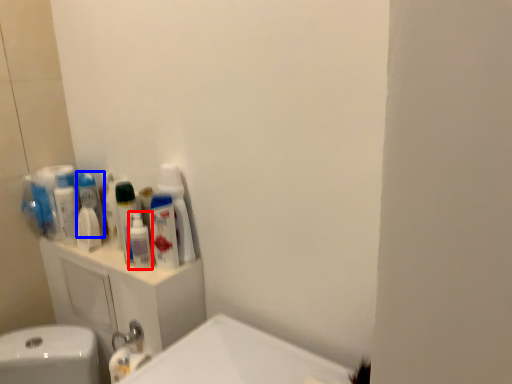
Question: Which point is further to the camera, mouthwash (highlighted by a red box) or mouthwash (highlighted by a blue box)?

Choices:
 (A) mouthwash
 (B) mouthwash

Answer: (B)